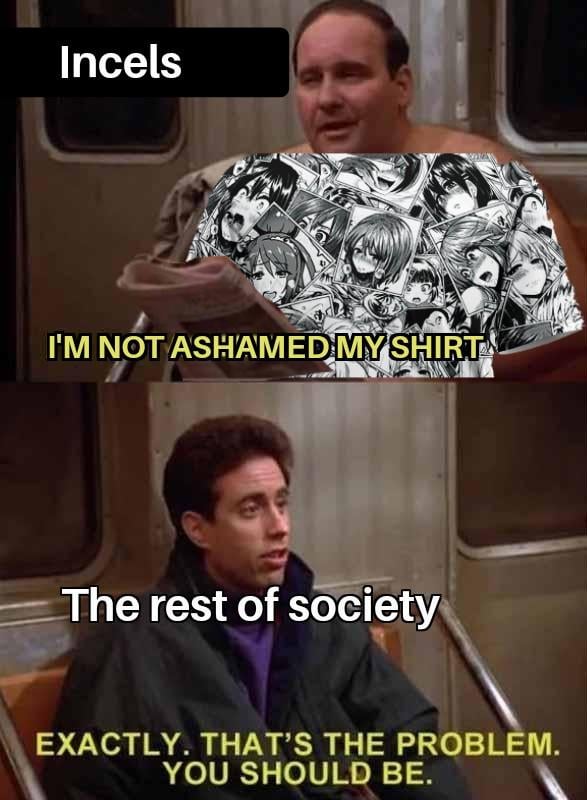
Identify the location of window. The width and height of the screenshot is (587, 800). (518, 474), (60, 466), (119, 114), (548, 73).